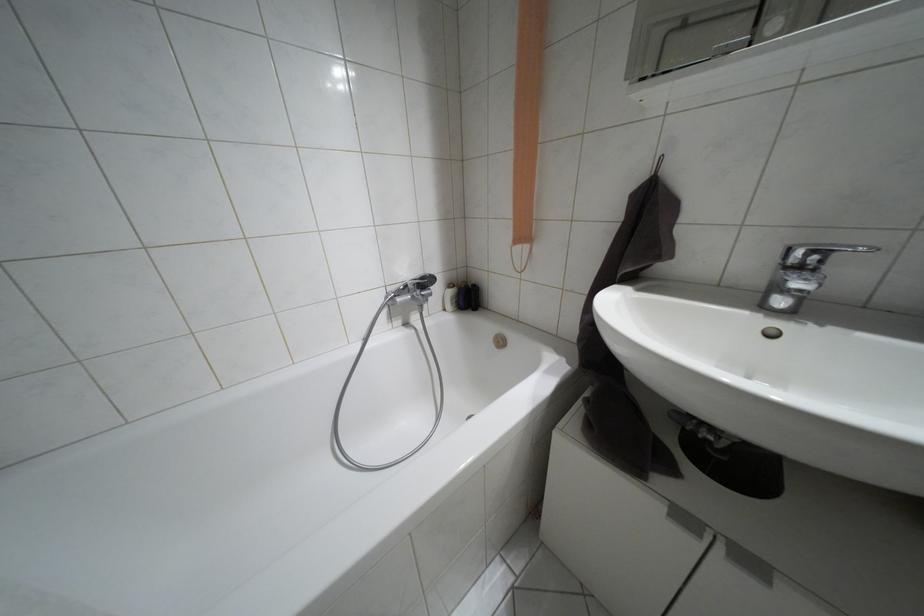
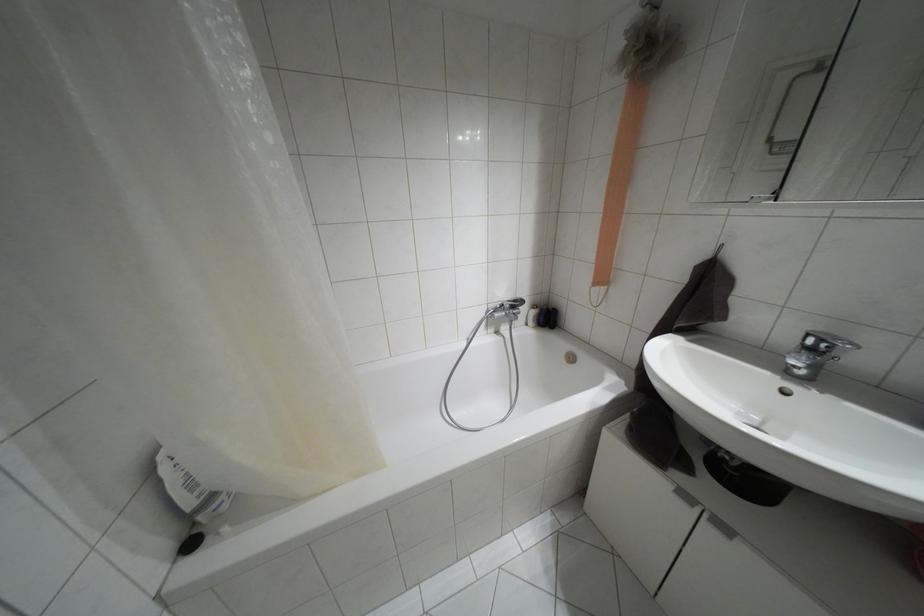
Find the pixel in the second image that matches point (420, 277) in the first image.

(514, 301)